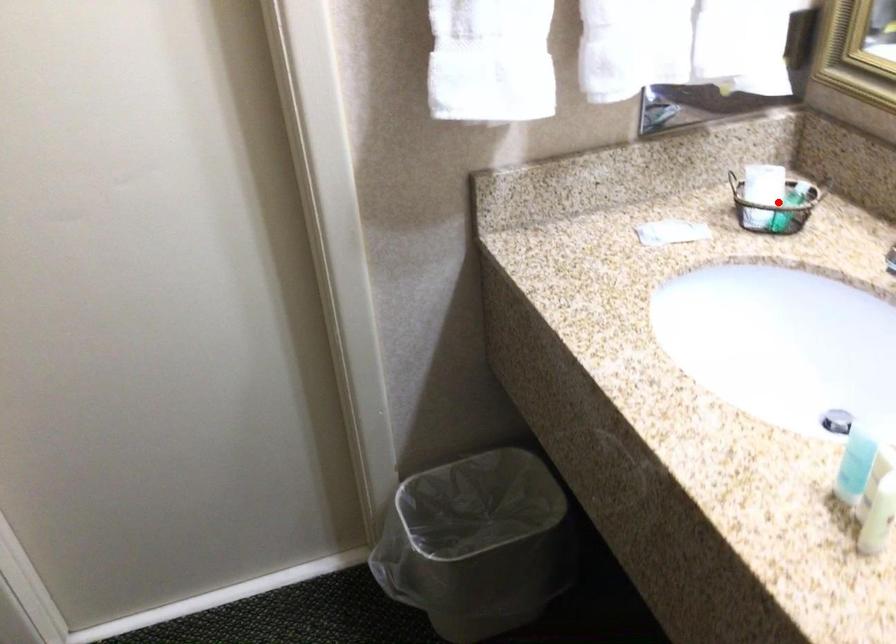
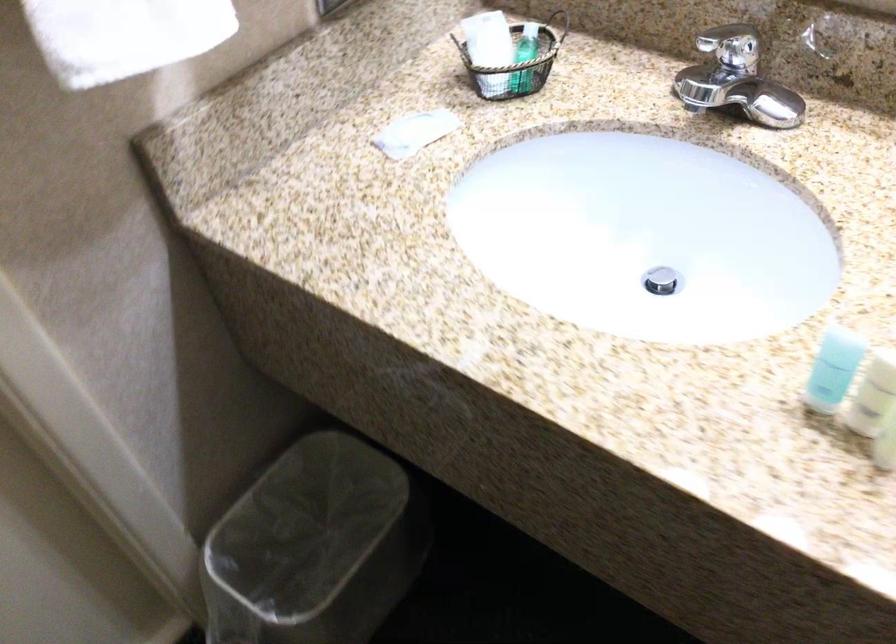
Question: I am providing you with two images of the same scene from different viewpoints. Given a red point in image1, look at the same physical point in image2. Is it:

Choices:
 (A) Closer to the viewpoint
 (B) Farther from the viewpoint

Answer: (A)